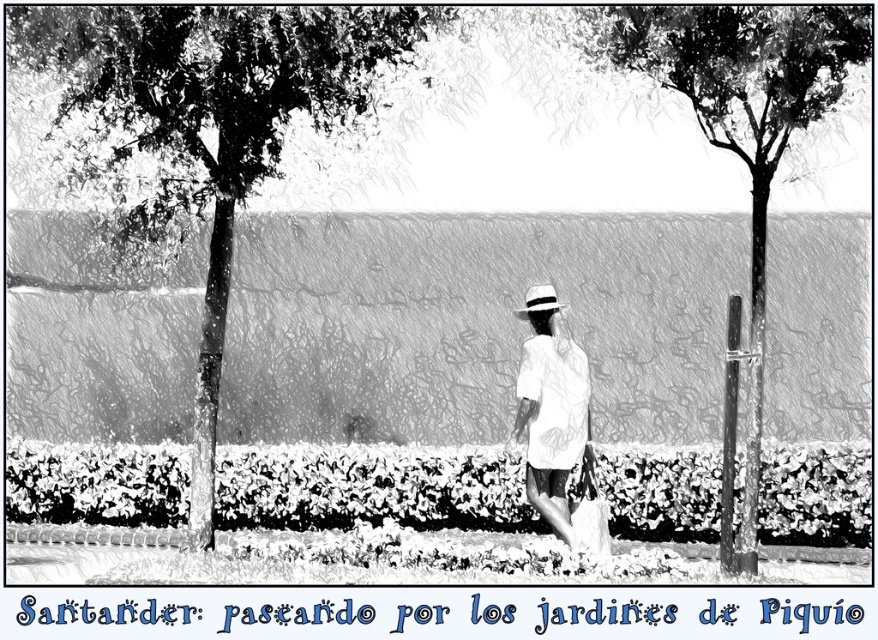
Is point (222, 48) behind point (553, 296)?

No, (222, 48) is closer to viewer.

Locate an element on the screen. The height and width of the screenshot is (640, 878). green leafy tree at center is located at coordinates coord(209,122).

The image size is (878, 640). Find the location of `green leafy tree at center`. green leafy tree at center is located at coordinates (209, 122).

Can you confirm if soft green hedge at center is thinner than white woven straw hat at center?

Yes, soft green hedge at center is thinner than white woven straw hat at center.

Can you confirm if soft green hedge at center is wider than white woven straw hat at center?

Incorrect, soft green hedge at center's width does not surpass white woven straw hat at center's.

Measure the distance between soft green hedge at center and camera.

soft green hedge at center and camera are 14.32 meters apart.

Where is `soft green hedge at center`? The height and width of the screenshot is (640, 878). soft green hedge at center is located at coordinates (369, 486).

Can you confirm if smooth bark tree at center is positioned below white matte dress at center?

Actually, smooth bark tree at center is above white matte dress at center.

Is smooth bark tree at center positioned at the back of white matte dress at center?

No, it is in front of white matte dress at center.

Is point (697, 6) less distant than point (529, 480)?

Yes, it is in front of point (529, 480).

What are the coordinates of `smooth bark tree at center` in the screenshot? It's located at (740, 141).